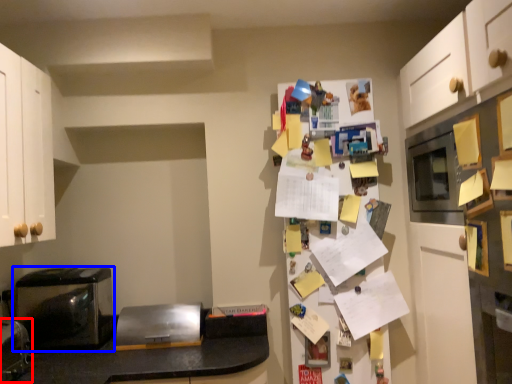
Question: Among these objects, which one is farthest to the camera, appliance (highlighted by a red box) or home appliance (highlighted by a blue box)?

Choices:
 (A) appliance
 (B) home appliance

Answer: (B)